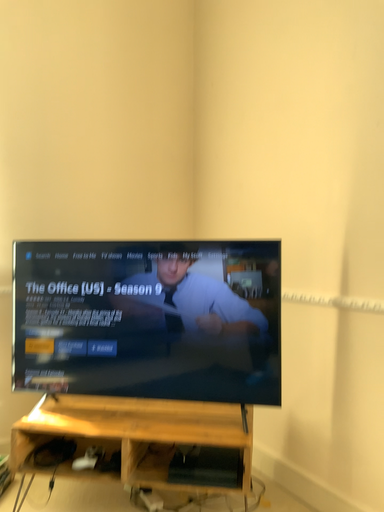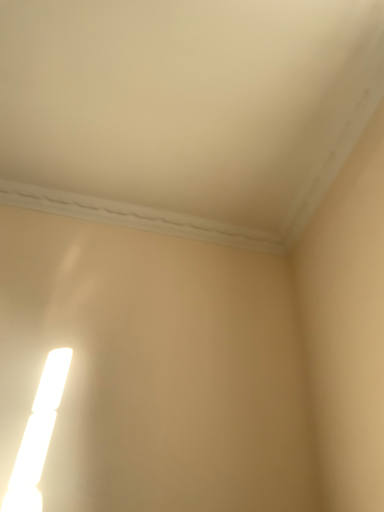
Question: Which way did the camera rotate in the video?

Choices:
 (A) rotated left
 (B) rotated right

Answer: (A)